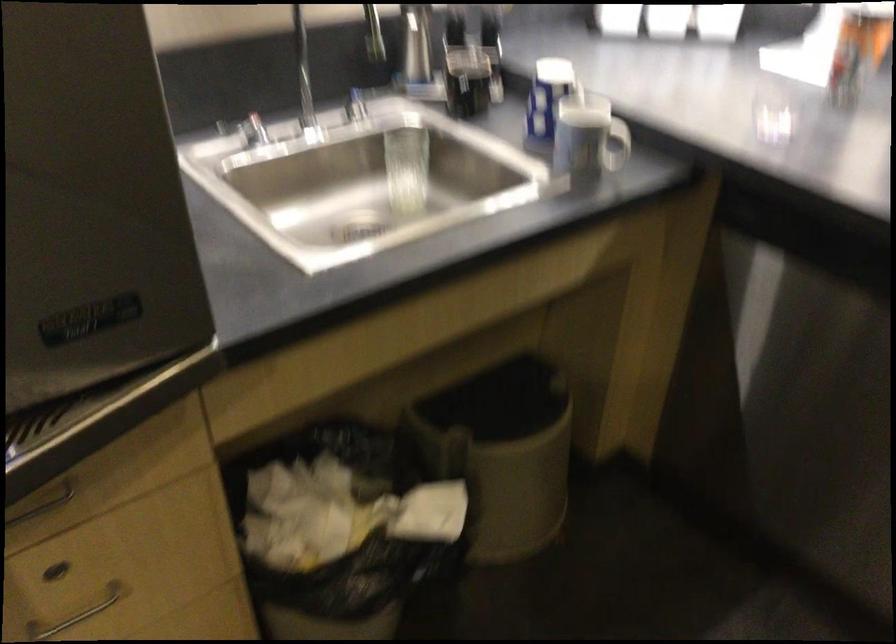
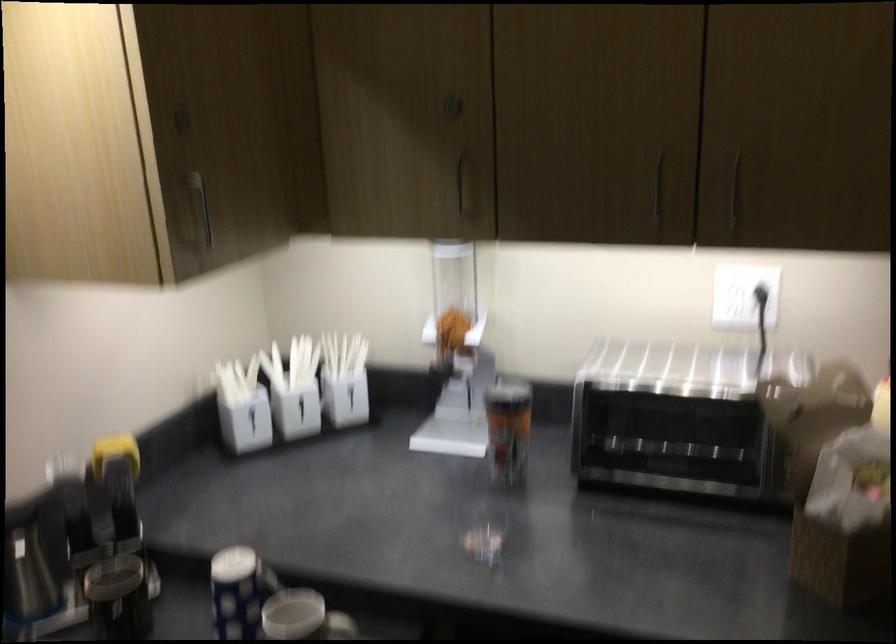
Question: The camera is either moving clockwise (left) or counter-clockwise (right) around the object. The first image is from the beginning of the video and the second image is from the end. Is the camera moving left or right when shooting the video?

Choices:
 (A) Left
 (B) Right

Answer: (A)